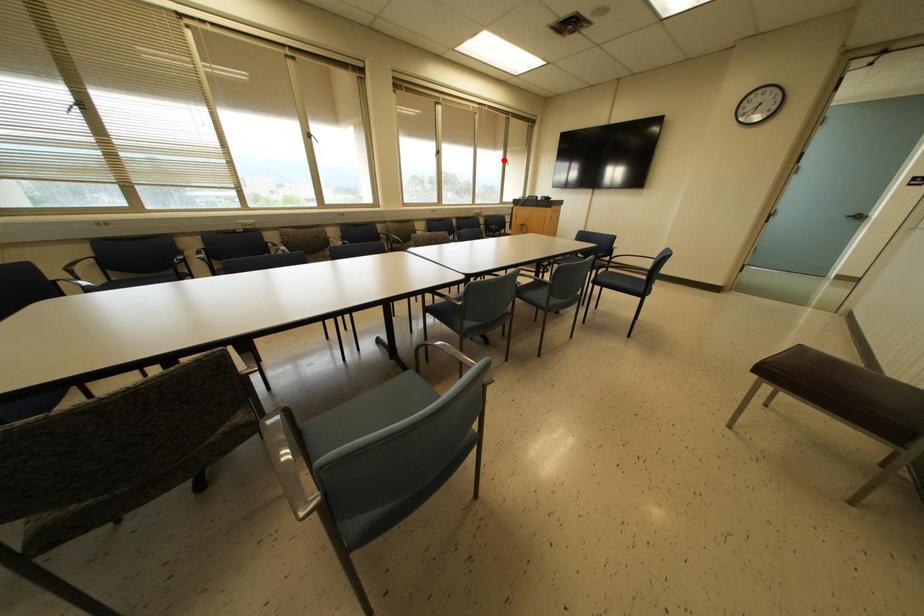
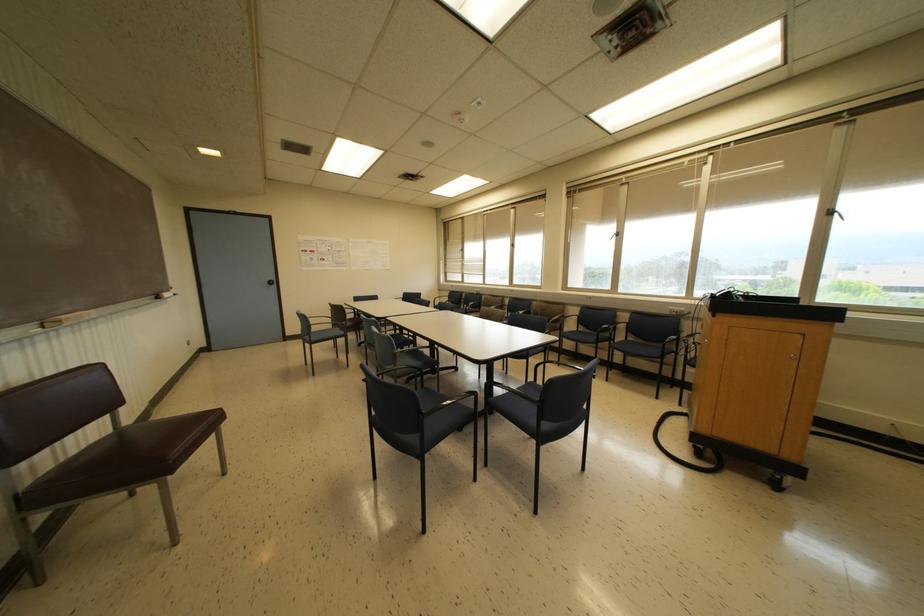
In the second image, find the point that corresponds to the highlighted location in the first image.

(827, 213)